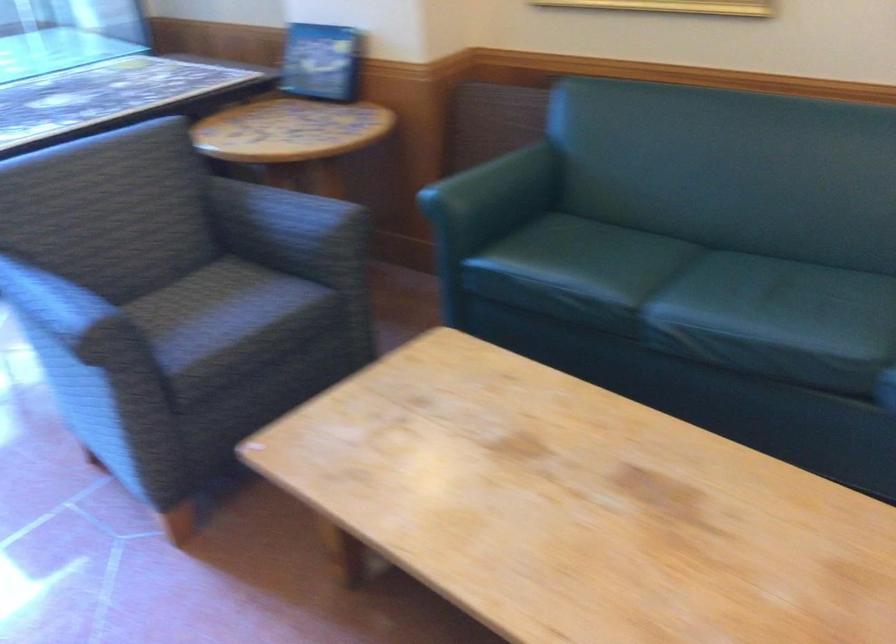
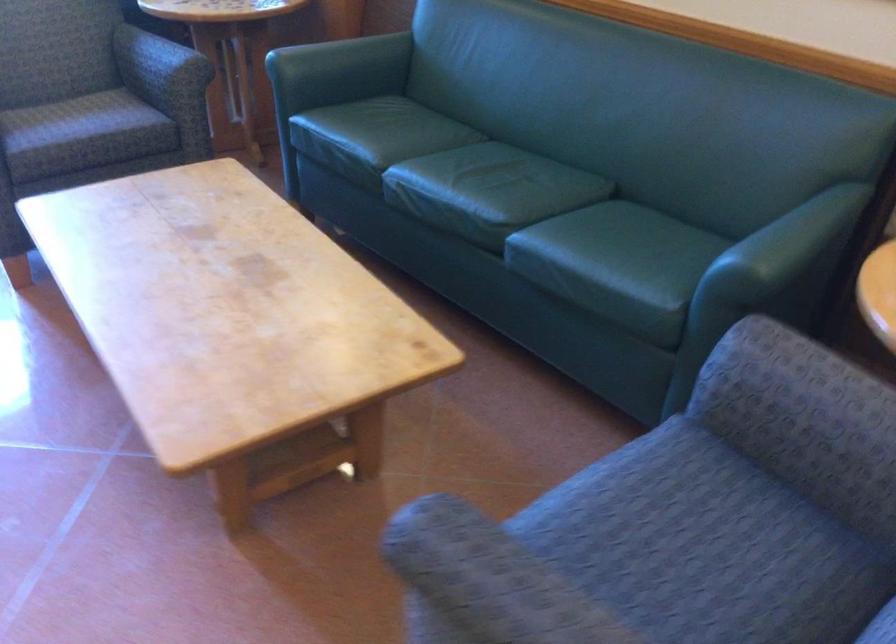
The images are taken continuously from a first-person perspective. In which direction are you moving?

The movement direction of the cameraman is right, backward.